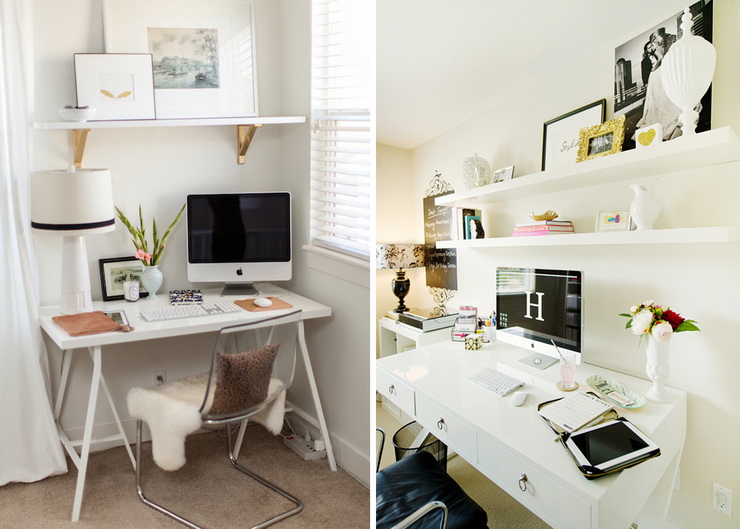
Where is `chair`? chair is located at coordinates click(x=258, y=377), click(x=431, y=487).